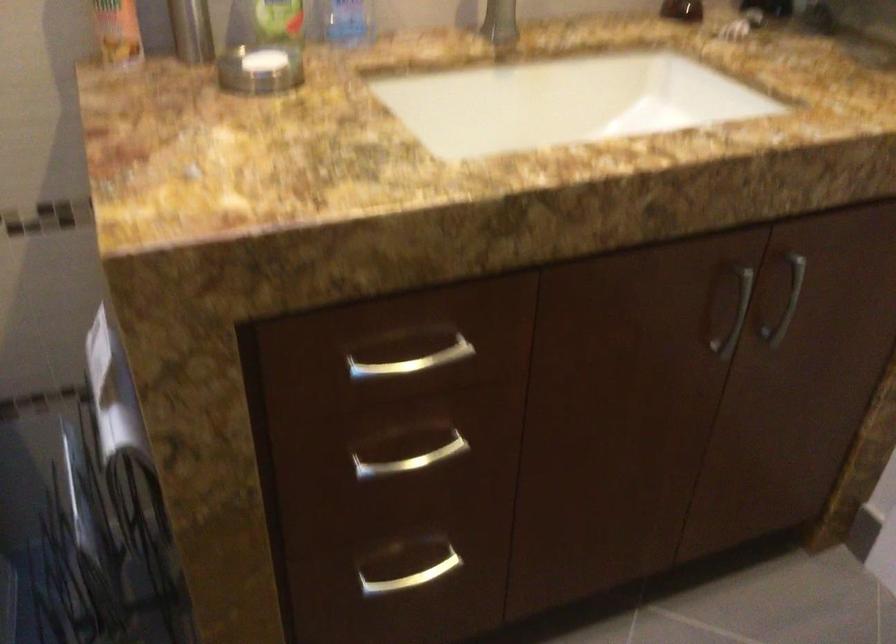
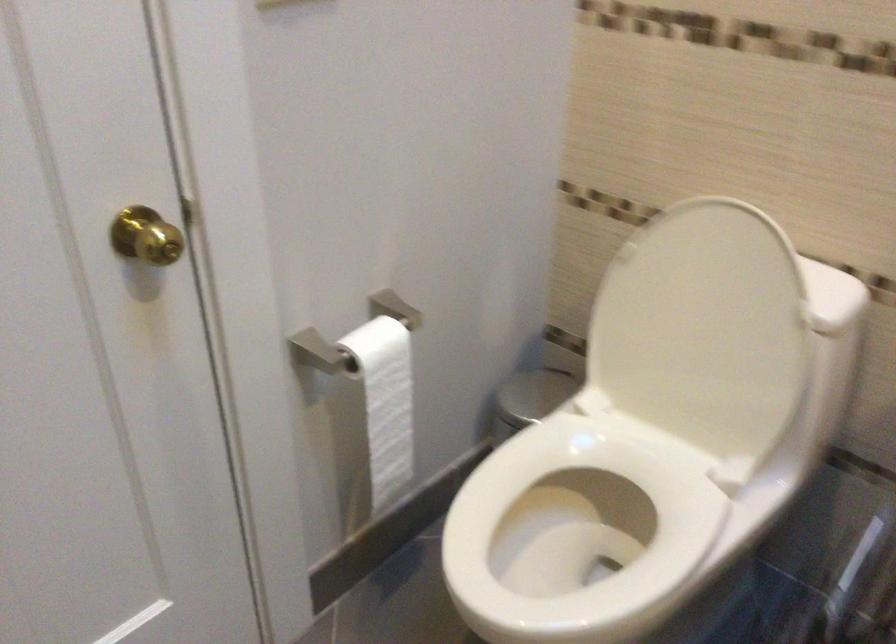
Question: Based on the continuous images, in which direction is the camera rotating? Reply with the corresponding letter.

Choices:
 (A) Left
 (B) Right
 (C) Up
 (D) Down

Answer: (A)